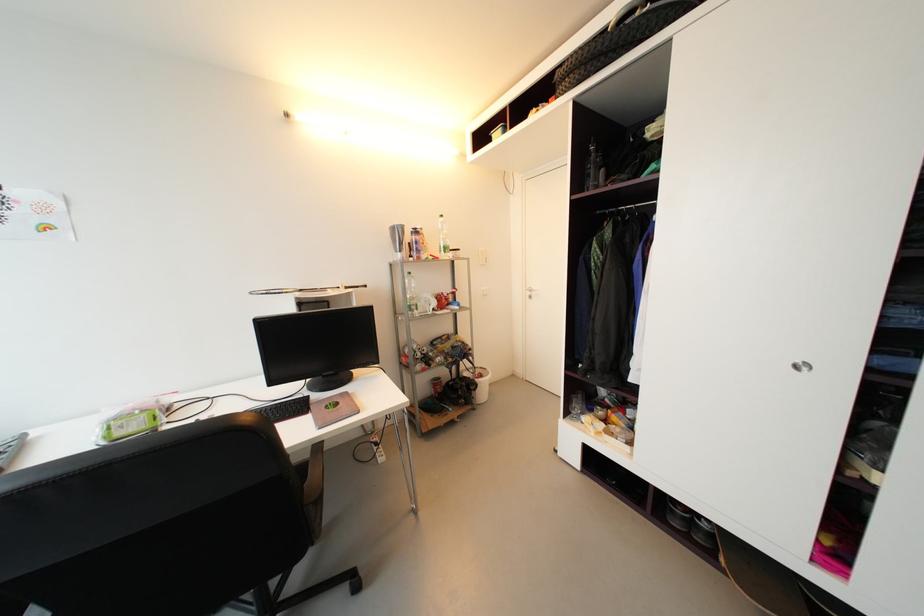
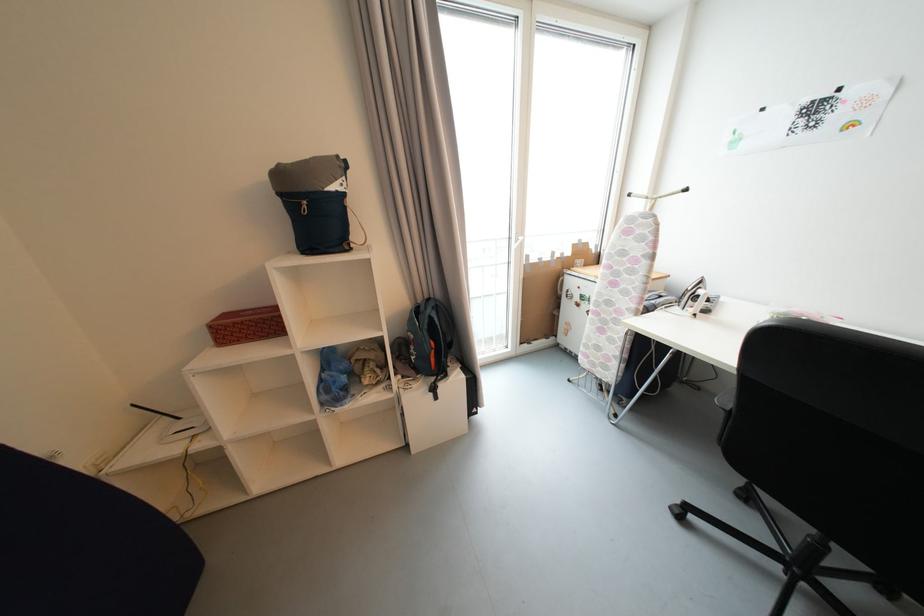
How did the camera likely rotate?

The rotation direction of the camera is left-down.